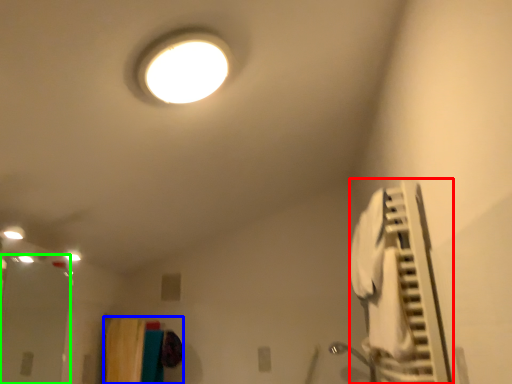
Question: Which is farther away from air conditioner (highlighted by a red box)? laundry (highlighted by a blue box) or glass door (highlighted by a green box)?

Choices:
 (A) laundry
 (B) glass door

Answer: (B)